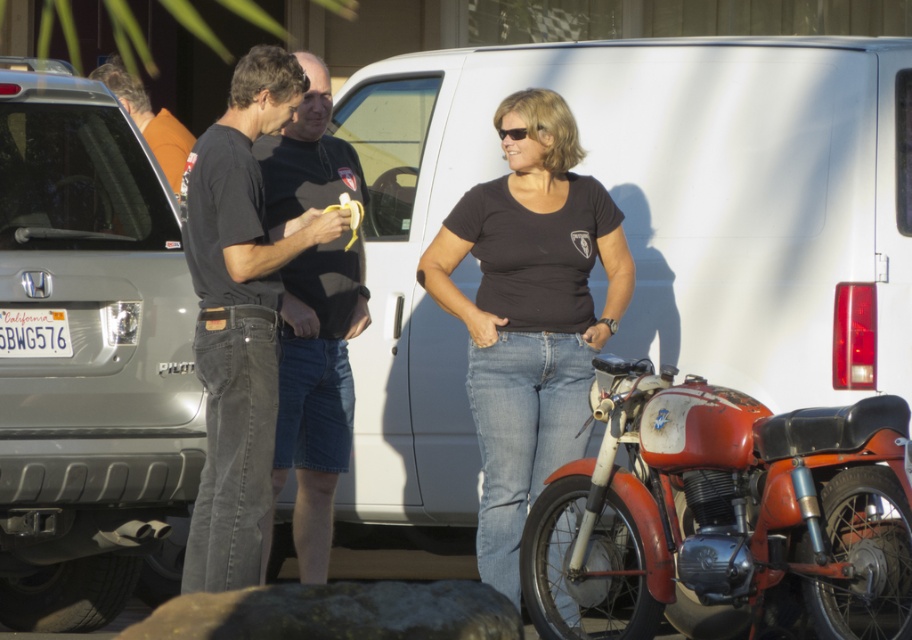
Question: Does rusty metal motorcycle at lower right lie in front of orange t-shirt at left?

Choices:
 (A) no
 (B) yes

Answer: (B)

Question: Which is farther from the rusty metal motorcycle at lower right?

Choices:
 (A) orange t-shirt at left
 (B) black cotton shirt at center
 (C) black matte t-shirt at center

Answer: (A)

Question: From the image, what is the correct spatial relationship of black cotton shirt at center in relation to orange t-shirt at left?

Choices:
 (A) right
 (B) left

Answer: (A)

Question: Is black cotton shirt at center below dark gray t-shirt at center?

Choices:
 (A) yes
 (B) no

Answer: (A)

Question: Which point is farther from the camera taking this photo?

Choices:
 (A) (163, 122)
 (B) (349, 445)

Answer: (A)

Question: Which object is positioned closest to the white plastic license plate at center?

Choices:
 (A) rusty metal motorcycle at lower right
 (B) dark gray t-shirt at center
 (C) silver metallic minivan at left
 (D) black cotton shirt at center

Answer: (C)